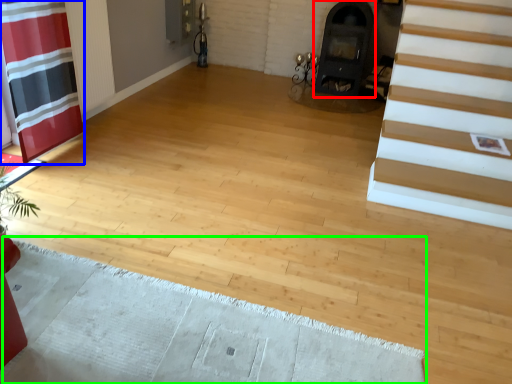
Question: Which object is the farthest from fireplace (highlighted by a red box)? Choose among these: curtain (highlighted by a blue box) or doormat (highlighted by a green box).

Choices:
 (A) curtain
 (B) doormat

Answer: (B)